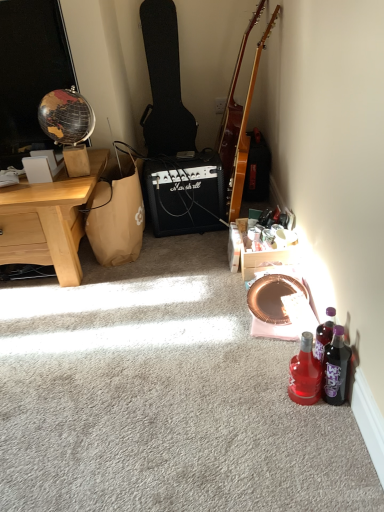
Question: Can you confirm if wooden crate at lower right is positioned to the right of black plastic marshall amplifier at center?

Choices:
 (A) yes
 (B) no

Answer: (A)

Question: Is wooden crate at lower right next to black plastic marshall amplifier at center and touching it?

Choices:
 (A) no
 (B) yes

Answer: (A)

Question: From the image's perspective, is wooden crate at lower right below black plastic marshall amplifier at center?

Choices:
 (A) no
 (B) yes

Answer: (B)

Question: Is wooden crate at lower right oriented away from black plastic marshall amplifier at center?

Choices:
 (A) no
 (B) yes

Answer: (A)

Question: From a real-world perspective, does wooden crate at lower right stand above black plastic marshall amplifier at center?

Choices:
 (A) yes
 (B) no

Answer: (B)

Question: Would you say wooden crate at lower right is a long distance from black plastic marshall amplifier at center?

Choices:
 (A) yes
 (B) no

Answer: (B)

Question: From a real-world perspective, is glossy wood guitar at upper right, the first guitar in the right-to-left sequence, below black plastic marshall amplifier at center?

Choices:
 (A) no
 (B) yes

Answer: (A)

Question: Is glossy wood guitar at upper right, which appears as the second guitar when viewed from the left, smaller than black plastic marshall amplifier at center?

Choices:
 (A) yes
 (B) no

Answer: (B)

Question: Could you tell me if glossy wood guitar at upper right, which appears as the second guitar when viewed from the left, is turned towards black plastic marshall amplifier at center?

Choices:
 (A) no
 (B) yes

Answer: (B)

Question: Is the surface of glossy wood guitar at upper right, which appears as the second guitar when viewed from the left, in direct contact with black plastic marshall amplifier at center?

Choices:
 (A) yes
 (B) no

Answer: (B)

Question: Can you confirm if glossy wood guitar at upper right, which appears as the second guitar when viewed from the left, is wider than black plastic marshall amplifier at center?

Choices:
 (A) no
 (B) yes

Answer: (A)

Question: Is glossy wood guitar at upper right, the first guitar in the right-to-left sequence, shorter than black plastic marshall amplifier at center?

Choices:
 (A) yes
 (B) no

Answer: (B)

Question: Is wooden crate at lower right taller than glossy wood guitar at upper right, the first guitar in the right-to-left sequence?

Choices:
 (A) yes
 (B) no

Answer: (B)